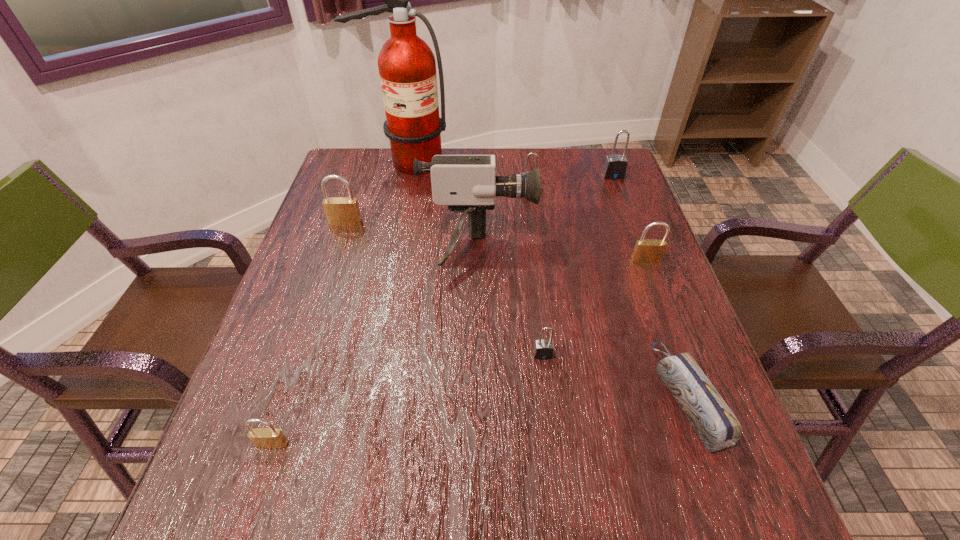
Locate an element on the screen. vacant space located on the shackle of the second farthest gray padlock is located at coordinates (536, 238).

Image resolution: width=960 pixels, height=540 pixels. I want to click on free location located on the front-facing side of the second farthest brass padlock, so click(x=688, y=374).

Locate an element on the screen. This screenshot has width=960, height=540. vacant space situated on the shackle of the fifth farthest padlock is located at coordinates (560, 498).

At what (x,y) coordinates should I click in order to perform the action: click on free region located 0.080m on the front-facing side of the nearest padlock. Please return your answer as a coordinate pair (x, y). The image size is (960, 540). Looking at the image, I should click on (254, 498).

This screenshot has height=540, width=960. In order to click on vacant space located 0.240m on the back of the pencil box in this screenshot , I will do `click(641, 266)`.

At what (x,y) coordinates should I click in order to perform the action: click on fire extinguisher that is at the far edge. Please return your answer as a coordinate pair (x, y). Looking at the image, I should click on (407, 67).

Where is `fire extinguisher situated at the left edge`? This screenshot has height=540, width=960. fire extinguisher situated at the left edge is located at coordinates (407, 67).

Identify the location of pencil box situated at the right edge. (716, 425).

Locate an element on the screen. Image resolution: width=960 pixels, height=540 pixels. object situated at the far left corner is located at coordinates (407, 67).

The width and height of the screenshot is (960, 540). In order to click on object that is at the far right corner in this screenshot , I will do `click(615, 166)`.